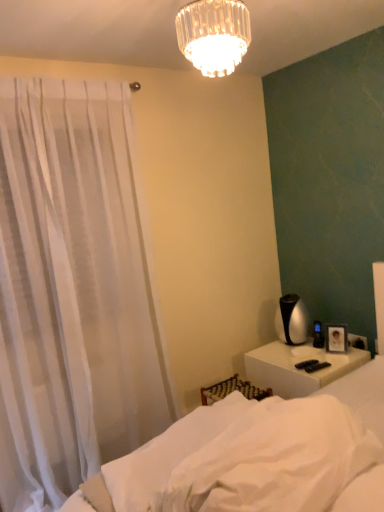
Question: Which direction should I rotate to look at white soft fabric at lower center, placed as the 2th sheet when sorted from front to back, — up or down?

Choices:
 (A) up
 (B) down

Answer: (B)

Question: Considering the relative sizes of white soft fabric at lower center, placed as the 2th sheet when sorted from front to back, and white glossy nightstand at lower right in the image provided, is white soft fabric at lower center, placed as the 2th sheet when sorted from front to back, bigger than white glossy nightstand at lower right?

Choices:
 (A) no
 (B) yes

Answer: (A)

Question: From the image's perspective, is white soft fabric at lower center, which is counted as the first sheet, starting from the back, on white glossy nightstand at lower right?

Choices:
 (A) no
 (B) yes

Answer: (B)

Question: From the image's perspective, is white soft fabric at lower center, placed as the 2th sheet when sorted from front to back, below white glossy nightstand at lower right?

Choices:
 (A) no
 (B) yes

Answer: (A)

Question: Does white soft fabric at lower center, placed as the 2th sheet when sorted from front to back, have a greater width compared to white glossy nightstand at lower right?

Choices:
 (A) yes
 (B) no

Answer: (B)

Question: Is white soft fabric at lower center, which is counted as the first sheet, starting from the back, outside white glossy nightstand at lower right?

Choices:
 (A) no
 (B) yes

Answer: (B)

Question: Does white soft fabric at lower center, placed as the 2th sheet when sorted from front to back, appear on the left side of white glossy nightstand at lower right?

Choices:
 (A) no
 (B) yes

Answer: (B)

Question: From the image's perspective, is white soft fabric at lower center, placed as the 2th sheet when sorted from front to back, located beneath white soft fabric at lower center, the second sheet when ordered from back to front?

Choices:
 (A) yes
 (B) no

Answer: (A)

Question: Considering the relative sizes of white soft fabric at lower center, placed as the 2th sheet when sorted from front to back, and white soft fabric at lower center, the second sheet when ordered from back to front, in the image provided, is white soft fabric at lower center, placed as the 2th sheet when sorted from front to back, shorter than white soft fabric at lower center, the second sheet when ordered from back to front,?

Choices:
 (A) yes
 (B) no

Answer: (A)

Question: Is white soft fabric at lower center, which is counted as the first sheet, starting from the back, taller than white soft fabric at lower center, the 1th sheet positioned from the front?

Choices:
 (A) no
 (B) yes

Answer: (A)

Question: From a real-world perspective, does white soft fabric at lower center, which is counted as the first sheet, starting from the back, sit lower than white soft fabric at lower center, the 1th sheet positioned from the front?

Choices:
 (A) no
 (B) yes

Answer: (B)

Question: Can you confirm if white soft fabric at lower center, which is counted as the first sheet, starting from the back, is thinner than white soft fabric at lower center, the second sheet when ordered from back to front?

Choices:
 (A) no
 (B) yes

Answer: (A)

Question: Considering the relative positions of white soft fabric at lower center, which is counted as the first sheet, starting from the back, and white soft fabric at lower center, the 1th sheet positioned from the front, in the image provided, is white soft fabric at lower center, which is counted as the first sheet, starting from the back, in front of white soft fabric at lower center, the 1th sheet positioned from the front,?

Choices:
 (A) yes
 (B) no

Answer: (B)

Question: Is white soft fabric bed at lower right completely or partially outside of white sheer curtain at left?

Choices:
 (A) no
 (B) yes

Answer: (B)